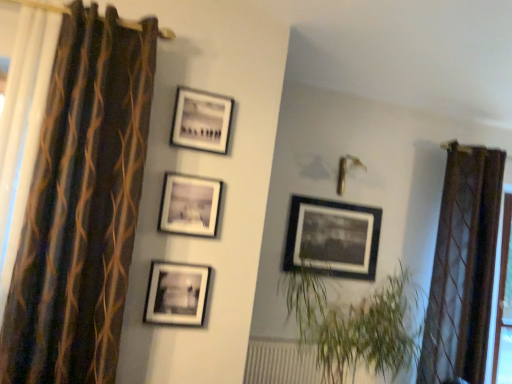
Question: Which direction should I rotate to face matte black picture frame at center, the 1th picture frame when ordered from back to front, — up or down?

Choices:
 (A) up
 (B) down

Answer: (B)

Question: Is matte black picture frame at center, which is the 2th picture frame in left-to-right order, with brown striped curtain at left, which is counted as the second curtain, starting from the right?

Choices:
 (A) no
 (B) yes

Answer: (A)

Question: Are matte black picture frame at center, which is the 2th picture frame in left-to-right order, and brown striped curtain at left, the second curtain positioned from the back, far apart?

Choices:
 (A) no
 (B) yes

Answer: (A)

Question: Can you confirm if matte black picture frame at center, the 3th picture frame when ordered from back to front, is smaller than brown striped curtain at left, which is counted as the second curtain, starting from the right?

Choices:
 (A) no
 (B) yes

Answer: (B)

Question: Can you confirm if matte black picture frame at center, which is the 2th picture frame in left-to-right order, is taller than brown striped curtain at left, which is counted as the second curtain, starting from the right?

Choices:
 (A) no
 (B) yes

Answer: (A)

Question: Is brown striped curtain at left, which is counted as the second curtain, starting from the right, a part of matte black picture frame at center, the 3th picture frame when ordered from back to front?

Choices:
 (A) yes
 (B) no

Answer: (B)

Question: From a real-world perspective, is matte black picture frame at center, which is counted as the 3th picture frame, starting from the right, positioned under brown striped curtain at left, the second curtain positioned from the back, based on gravity?

Choices:
 (A) yes
 (B) no

Answer: (B)

Question: Is matte black picture frame at center, acting as the 4th picture frame starting from the left, completely or partially inside brown striped curtain at left, which appears as the first curtain when viewed from the left?

Choices:
 (A) yes
 (B) no

Answer: (B)

Question: Is brown striped curtain at left, the second curtain positioned from the back, located outside matte black picture frame at center, the 1th picture frame when ordered from back to front?

Choices:
 (A) yes
 (B) no

Answer: (A)

Question: Can you confirm if brown striped curtain at left, the second curtain positioned from the back, is thinner than matte black picture frame at center, acting as the 4th picture frame starting from the left?

Choices:
 (A) no
 (B) yes

Answer: (A)

Question: Is brown striped curtain at left, which appears as the first curtain when viewed from the left, at the left side of matte black picture frame at center, acting as the 4th picture frame starting from the left?

Choices:
 (A) no
 (B) yes

Answer: (B)

Question: Can you confirm if brown striped curtain at left, the second curtain positioned from the back, is taller than matte black picture frame at center, the 1th picture frame when ordered from back to front?

Choices:
 (A) yes
 (B) no

Answer: (A)

Question: Is brown striped curtain at left, which is counted as the second curtain, starting from the right, aimed at matte black picture frame at center, the first picture frame from the right?

Choices:
 (A) no
 (B) yes

Answer: (A)

Question: Considering the relative sizes of matte black picture frame at center, the 3th picture frame when ordered from back to front, and brown sheer curtain at right, arranged as the 2th curtain when viewed from the front, in the image provided, is matte black picture frame at center, the 3th picture frame when ordered from back to front, smaller than brown sheer curtain at right, arranged as the 2th curtain when viewed from the front,?

Choices:
 (A) yes
 (B) no

Answer: (A)